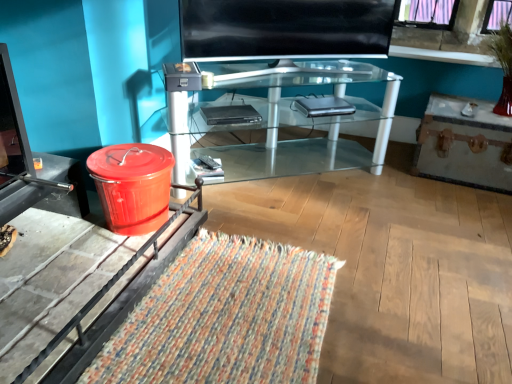
Where is `free area in between clear glass desk at center and woven multicolored mat at lower left`? This screenshot has height=384, width=512. free area in between clear glass desk at center and woven multicolored mat at lower left is located at coordinates (319, 223).